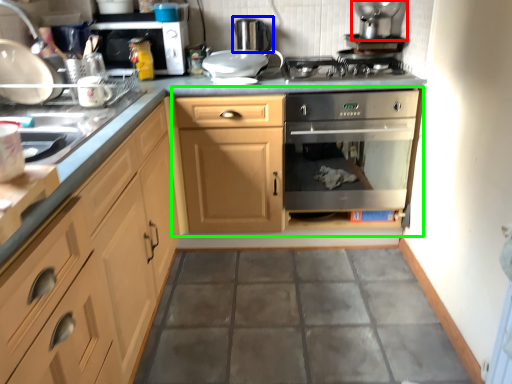
Question: Based on their relative distances, which object is nearer to appliance (highlighted by a red box)? Choose from appliance (highlighted by a blue box) and dresser (highlighted by a green box).

Choices:
 (A) appliance
 (B) dresser

Answer: (A)